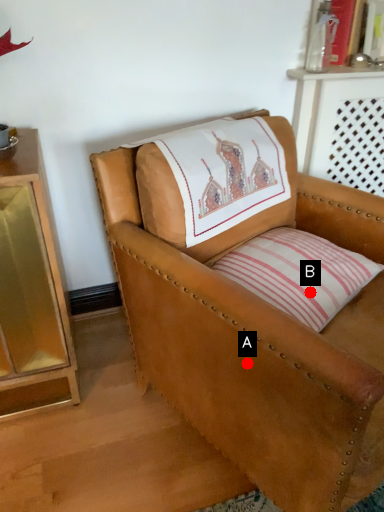
Question: Two points are circled on the image, labeled by A and B beside each circle. Which point is closer to the camera taking this photo?

Choices:
 (A) A is closer
 (B) B is closer

Answer: (A)